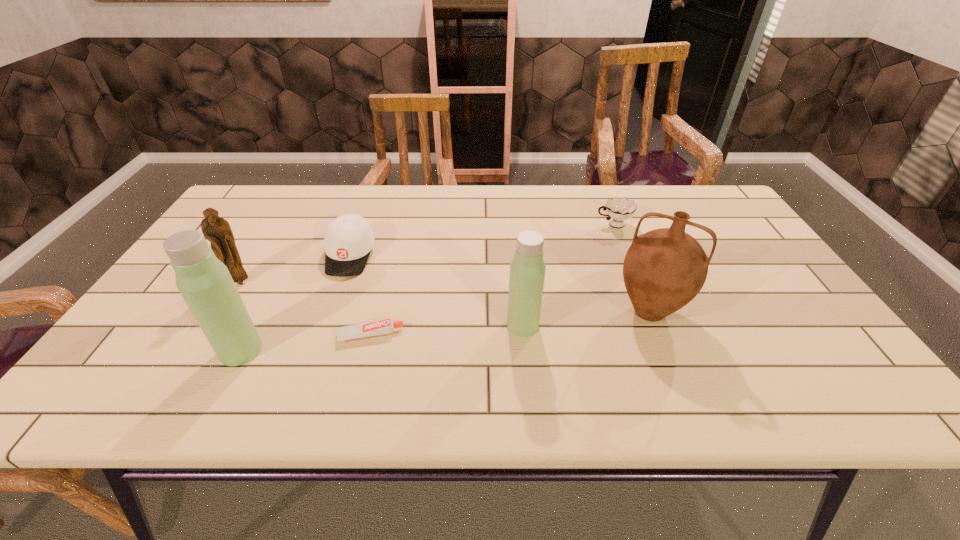
At what (x,y) coordinates should I click in order to perform the action: click on vacant space located 0.110m on the back of the sixth object from right to left. Please return your answer as a coordinate pair (x, y). This screenshot has height=540, width=960. Looking at the image, I should click on (267, 301).

Locate an element on the screen. This screenshot has width=960, height=540. vacant space located on the right of the shorter thermos bottle is located at coordinates (564, 325).

Locate an element on the screen. The width and height of the screenshot is (960, 540). free space located on the side of the second shortest object with the handle is located at coordinates 525,225.

Identify the location of vacant space positioned on the side of the second shortest object with the handle. The image size is (960, 540). (512, 225).

You are a GUI agent. You are given a task and a screenshot of the screen. Output one action in this format:
    pyautogui.click(x=<x>, y=<y>)
    Task: Click on the vacant space situated 0.330m on the side of the second shortest object with the handle
    Image resolution: width=960 pixels, height=540 pixels.
    Given the screenshot: What is the action you would take?
    pyautogui.click(x=486, y=225)

Locate an element on the screen. vacant space located on the back of the pitcher is located at coordinates (620, 241).

Identify the location of vacant space located 0.070m on the front-facing side of the baseball cap. The image size is (960, 540). (335, 298).

Where is `vacant region located 0.120m on the front-facing side of the leftmost object`? vacant region located 0.120m on the front-facing side of the leftmost object is located at coordinates point(217,321).

This screenshot has width=960, height=540. What are the coordinates of `free spot located on the left of the shortest object` in the screenshot? It's located at (236, 335).

At what (x,y) coordinates should I click in order to perform the action: click on object located at the far edge. Please return your answer as a coordinate pair (x, y). Looking at the image, I should click on (619, 209).